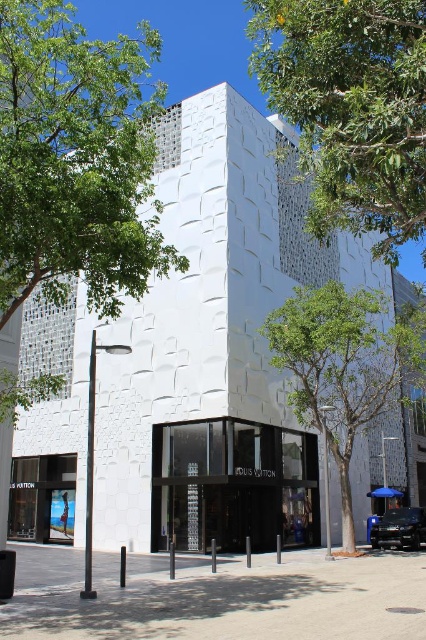
Can you confirm if green leafy tree at upper left is bigger than green leafy tree at upper right?

Yes.

Does point (22, 204) come closer to viewer compared to point (337, 90)?

No.

Identify the location of green leafy tree at upper left. (75, 160).

Can you confirm if green leafy tree at upper left is positioned below green leafy tree at center?

No, green leafy tree at upper left is not below green leafy tree at center.

Who is positioned more to the right, green leafy tree at upper left or green leafy tree at center?

From the viewer's perspective, green leafy tree at center appears more on the right side.

Where is `green leafy tree at upper left`? This screenshot has height=640, width=426. green leafy tree at upper left is located at coordinates (75, 160).

You are a GUI agent. You are given a task and a screenshot of the screen. Output one action in this format:
    pyautogui.click(x=<x>, y=<y>)
    Task: Click on the green leafy tree at upper left
    The height and width of the screenshot is (640, 426).
    Given the screenshot: What is the action you would take?
    pyautogui.click(x=75, y=160)

Does white textured building at center have a lesser height compared to green leafy tree at upper right?

No.

Between white textured building at center and green leafy tree at upper right, which one appears on the right side from the viewer's perspective?

Positioned to the right is white textured building at center.

Does point (169, 468) come behind point (313, 200)?

Yes.

Image resolution: width=426 pixels, height=640 pixels. Identify the location of white textured building at center. (215, 337).